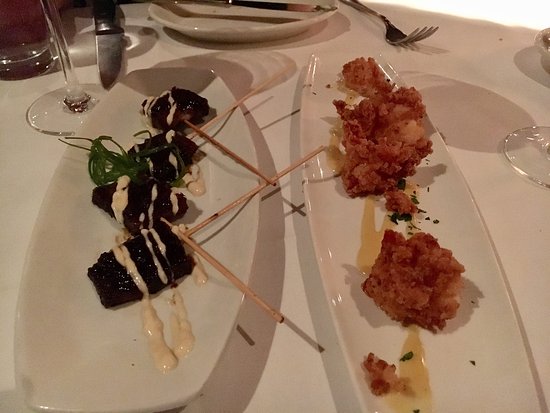
The image size is (550, 413). Identify the location of glass. (28, 33).